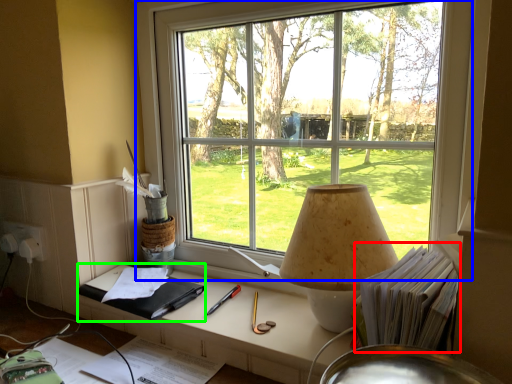
Question: Estimate the real-world distances between objects in this image. Which object is closer to book (highlighted by a red box), window (highlighted by a blue box) or notebook (highlighted by a green box)?

Choices:
 (A) window
 (B) notebook

Answer: (A)